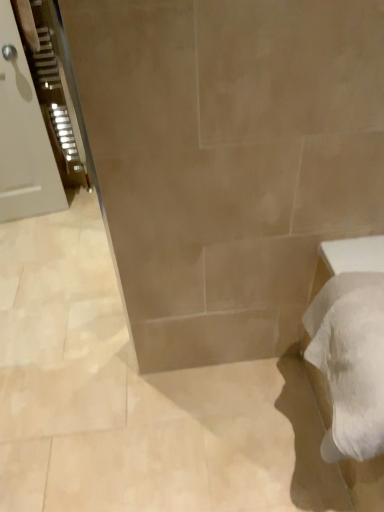
The width and height of the screenshot is (384, 512). Describe the element at coordinates (350, 362) in the screenshot. I see `white fluffy bath towel at lower right` at that location.

What is the approximate width of white fluffy bath towel at lower right?

The width of white fluffy bath towel at lower right is 14.25 inches.

I want to click on white fluffy bath towel at lower right, so click(350, 362).

Describe the element at coordinates (23, 135) in the screenshot. This screenshot has height=512, width=384. I see `matte white door at left` at that location.

Identify the location of matte white door at left. (23, 135).

At what (x,y) coordinates should I click in order to perform the action: click on white fluffy bath towel at lower right. Please return your answer as a coordinate pair (x, y). This screenshot has width=384, height=512. Looking at the image, I should click on (350, 362).

Considering the relative positions of matte white door at left and white fluffy bath towel at lower right in the image provided, is matte white door at left to the left or to the right of white fluffy bath towel at lower right?

matte white door at left is positioned on white fluffy bath towel at lower right's left side.

Is matte white door at left positioned behind white fluffy bath towel at lower right?

Yes, the depth of matte white door at left is greater than that of white fluffy bath towel at lower right.

Is point (30, 175) positioned in front of point (350, 369)?

No, it is not.

From the image's perspective, which one is positioned higher, matte white door at left or white fluffy bath towel at lower right?

matte white door at left is shown above in the image.

From a real-world perspective, between matte white door at left and white fluffy bath towel at lower right, who is vertically higher?

matte white door at left.

Between matte white door at left and white fluffy bath towel at lower right, which one has smaller width?

matte white door at left is thinner.

Is matte white door at left shorter than white fluffy bath towel at lower right?

Incorrect, the height of matte white door at left does not fall short of that of white fluffy bath towel at lower right.

Considering the sizes of objects matte white door at left and white fluffy bath towel at lower right in the image provided, who is smaller, matte white door at left or white fluffy bath towel at lower right?

With smaller size is matte white door at left.

Is white fluffy bath towel at lower right inside matte white door at left?

Actually, white fluffy bath towel at lower right is outside matte white door at left.

Is matte white door at left in contact with white fluffy bath towel at lower right?

No, matte white door at left is not next to white fluffy bath towel at lower right.

Based on the photo, is white fluffy bath towel at lower right at the back of matte white door at left?

No, white fluffy bath towel at lower right is not at the back of matte white door at left.

What's the angular difference between matte white door at left and white fluffy bath towel at lower right's facing directions?

90 degrees separate the facing orientations of matte white door at left and white fluffy bath towel at lower right.

Image resolution: width=384 pixels, height=512 pixels. I want to click on bath towel that is on the right side of matte white door at left, so click(350, 362).

Is white fluffy bath towel at lower right to the right of matte white door at left from the viewer's perspective?

Yes.

Based on the photo, is white fluffy bath towel at lower right further to camera compared to matte white door at left?

That is False.

Which point is more distant from viewer, (313, 338) or (56, 189)?

Point (56, 189)

From the image's perspective, which is above, white fluffy bath towel at lower right or matte white door at left?

matte white door at left appears higher in the image.

From a real-world perspective, is white fluffy bath towel at lower right physically above matte white door at left?

Incorrect, from a real-world perspective, white fluffy bath towel at lower right is lower than matte white door at left.

Looking at their sizes, would you say white fluffy bath towel at lower right is wider or thinner than matte white door at left?

white fluffy bath towel at lower right is wider than matte white door at left.

Considering the relative sizes of white fluffy bath towel at lower right and matte white door at left in the image provided, is white fluffy bath towel at lower right taller than matte white door at left?

In fact, white fluffy bath towel at lower right may be shorter than matte white door at left.

Who is smaller, white fluffy bath towel at lower right or matte white door at left?

matte white door at left is smaller.

Which is correct: white fluffy bath towel at lower right is inside matte white door at left, or outside of it?

white fluffy bath towel at lower right exists outside the volume of matte white door at left.

Is white fluffy bath towel at lower right far from matte white door at left?

Yes.

Is white fluffy bath towel at lower right turned away from matte white door at left?

white fluffy bath towel at lower right is not turned away from matte white door at left.

In the image, there is a matte white door at left. Where is `bath towel below it (from a real-world perspective)`? bath towel below it (from a real-world perspective) is located at coordinates (350, 362).

Locate an element on the screen. This screenshot has height=512, width=384. door that appears on the left of white fluffy bath towel at lower right is located at coordinates (23, 135).

Where is `bath towel in front of the matte white door at left`? This screenshot has height=512, width=384. bath towel in front of the matte white door at left is located at coordinates (350, 362).